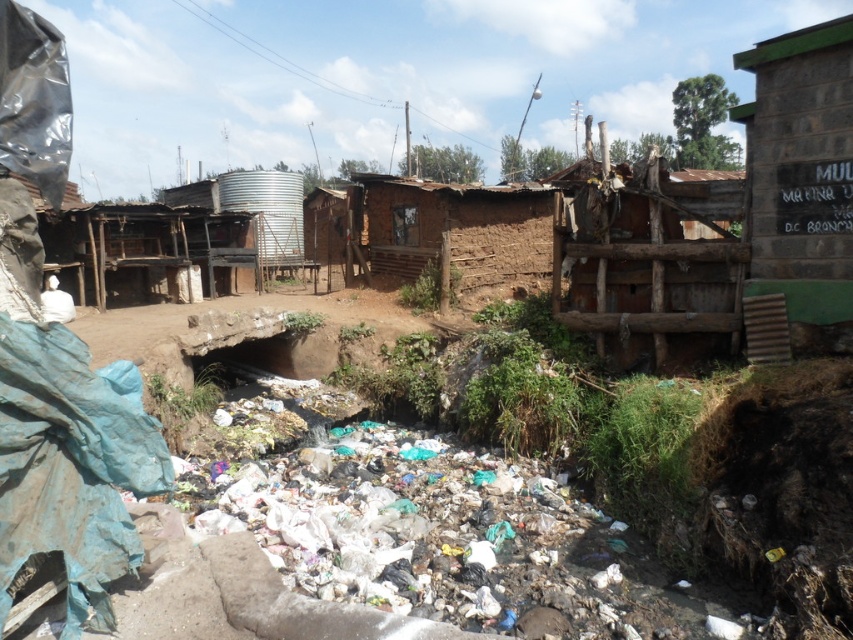
Question: Is the position of green painted mud hut at right more distant than that of brown wooden hut at center?

Choices:
 (A) no
 (B) yes

Answer: (A)

Question: Among these points, which one is farthest from the camera?

Choices:
 (A) (846, 259)
 (B) (184, 266)

Answer: (B)

Question: Does green painted mud hut at right appear on the left side of brown wooden hut at center?

Choices:
 (A) no
 (B) yes

Answer: (A)

Question: Which object is closer to the camera taking this photo?

Choices:
 (A) green painted mud hut at right
 (B) brown wooden hut at center

Answer: (A)

Question: Is green painted mud hut at right positioned behind brown wooden hut at center?

Choices:
 (A) no
 (B) yes

Answer: (A)

Question: Which object is farther from the camera taking this photo?

Choices:
 (A) brown wooden hut at center
 (B) green painted mud hut at right

Answer: (A)